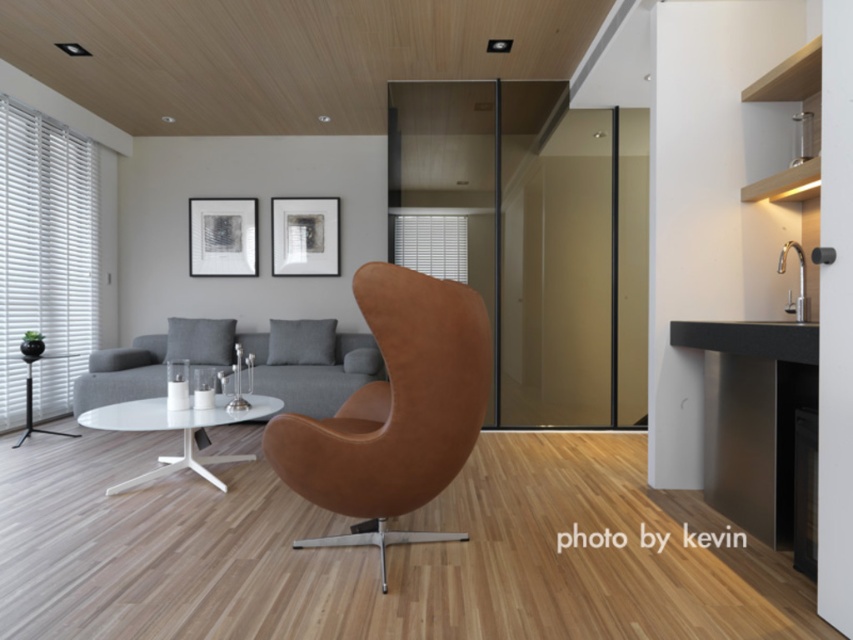
You are planning to move a large potted plant that is 1.5 meters wide into this living room. You want to place it near the transparent glass door at center and the white glossy glass table at center. Considering their sizes, which object should the plant be placed closer to?

The transparent glass door at center is bigger than the white glossy glass table at center, so the plant should be placed closer to the transparent glass door at center to ensure there is enough space.